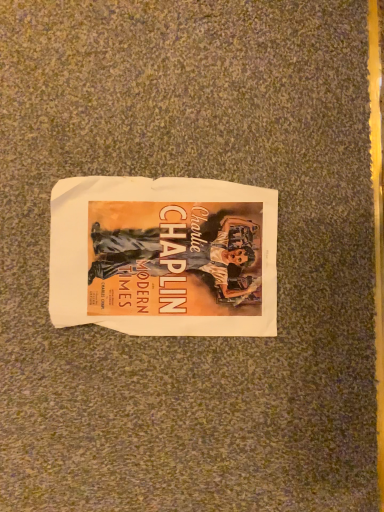
At what (x,y) coordinates should I click in order to perform the action: click on vacant area on top of orange paper poster at center (from a real-world perspective). Please return your answer as a coordinate pair (x, y). Image resolution: width=384 pixels, height=512 pixels. Looking at the image, I should click on (173, 246).